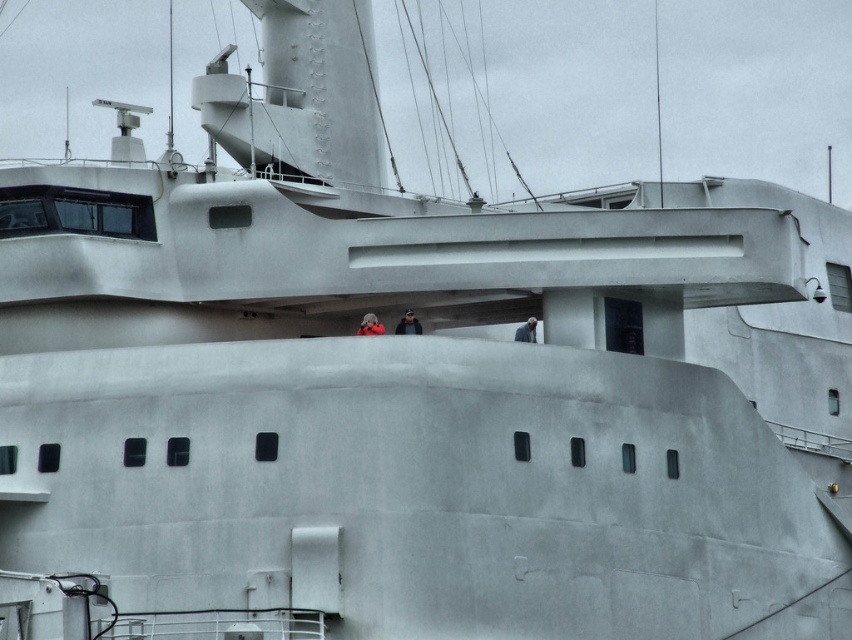
Question: Is dark gray fabric jacket at center closer to the viewer compared to red fabric person at center?

Choices:
 (A) yes
 (B) no

Answer: (B)

Question: Considering the real-world distances, which object is farthest from the smooth gray jacket at center?

Choices:
 (A) dark gray fabric jacket at center
 (B) red fabric person at center

Answer: (B)

Question: Does red fabric person at center have a lesser width compared to smooth gray jacket at center?

Choices:
 (A) yes
 (B) no

Answer: (A)

Question: Is dark gray fabric jacket at center wider than red fabric person at center?

Choices:
 (A) no
 (B) yes

Answer: (B)

Question: Which point is farther from the camera taking this photo?

Choices:
 (A) (522, 326)
 (B) (401, 317)

Answer: (B)

Question: Which object is farther from the camera taking this photo?

Choices:
 (A) red fabric person at center
 (B) dark gray fabric jacket at center
 (C) smooth gray jacket at center

Answer: (C)